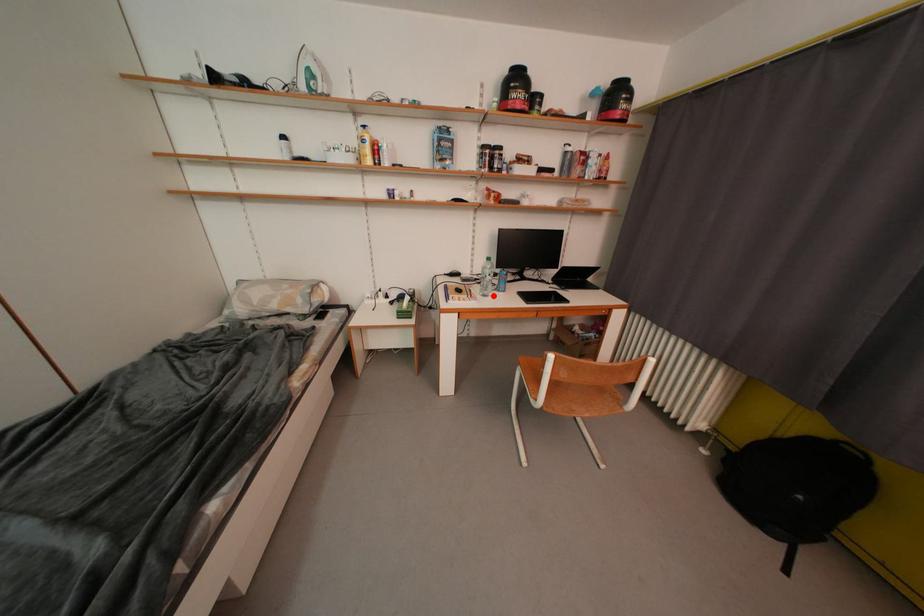
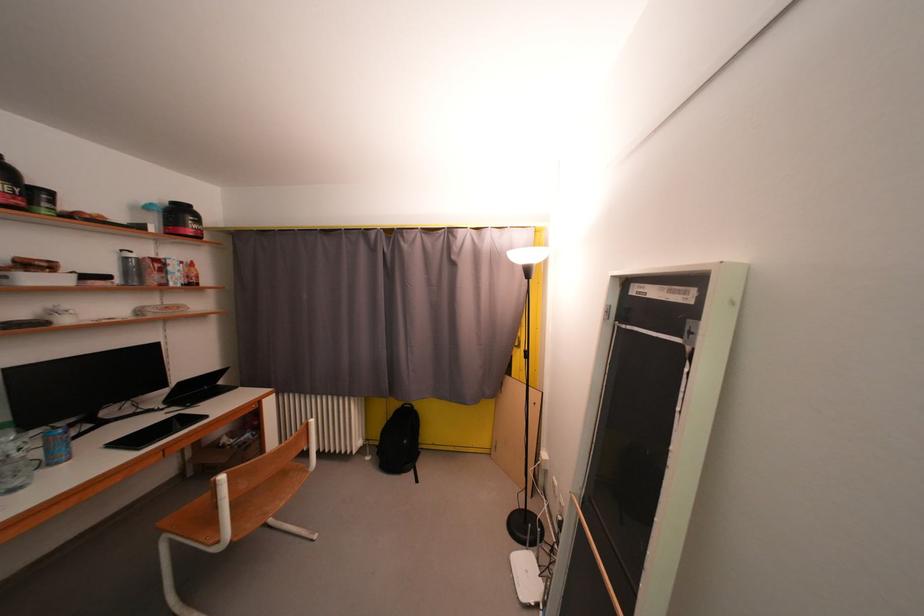
Question: I am providing you with two images of the same scene from different viewpoints. A red point is shown in image1. For the corresponding object point in image2, is it positioned nearer or farther from the camera?

Choices:
 (A) Nearer
 (B) Farther

Answer: (A)